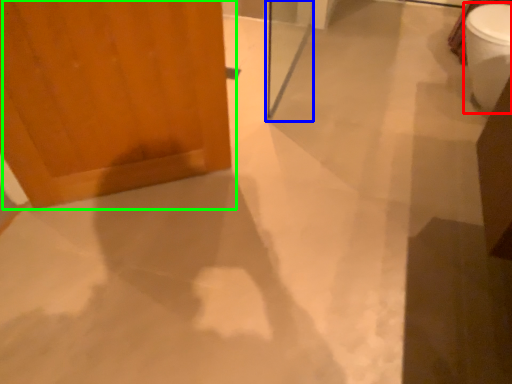
Question: Based on their relative distances, which object is nearer to toilet bowl (highlighted by a red box)? Choose from screen door (highlighted by a blue box) and door (highlighted by a green box).

Choices:
 (A) screen door
 (B) door

Answer: (A)